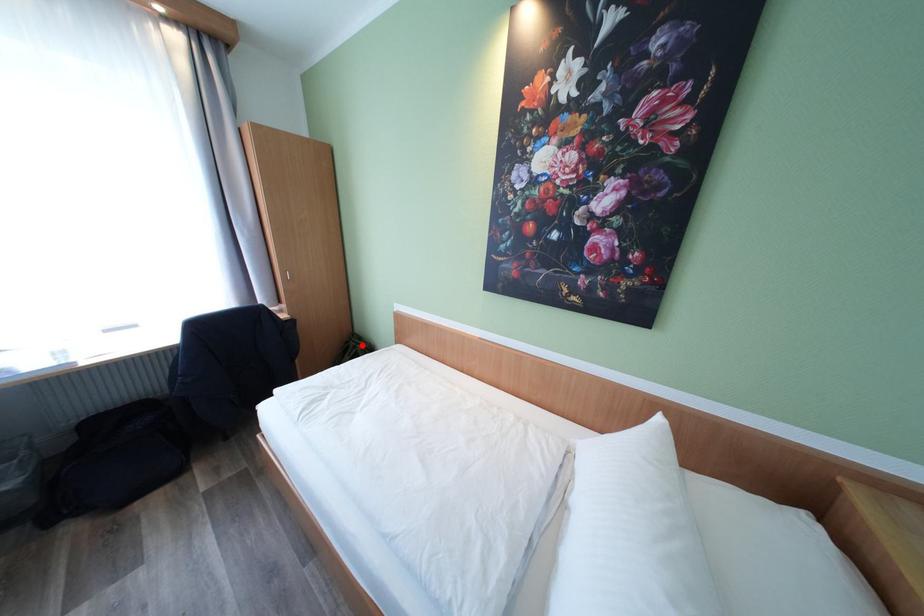
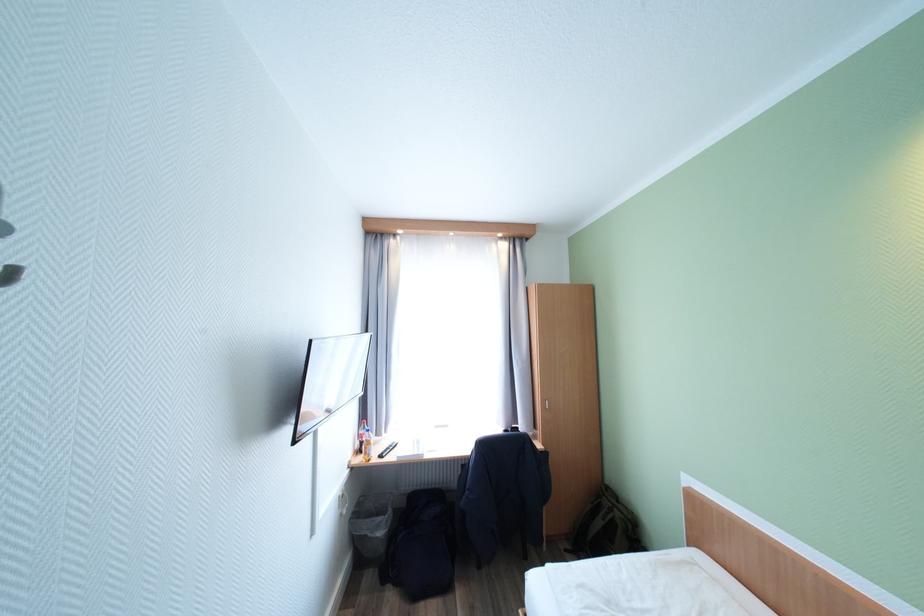
Question: I am providing you with two images of the same scene from different viewpoints. In image1, a red point is highlighted. Considering the same 3D point in image2, which of the following is correct?

Choices:
 (A) It is closer
 (B) It is farther

Answer: (A)